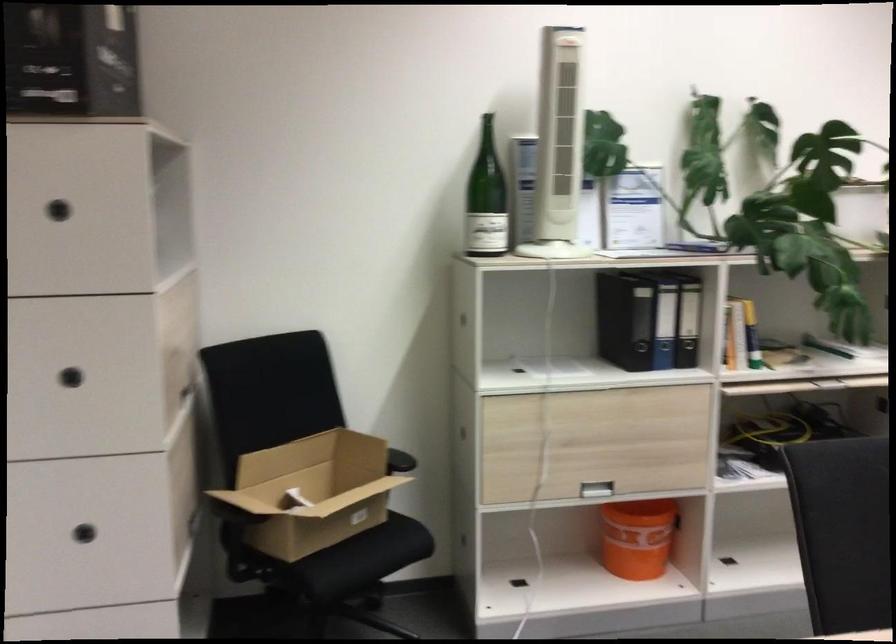
The width and height of the screenshot is (896, 644). I want to click on chair sitting surface, so click(x=381, y=545).